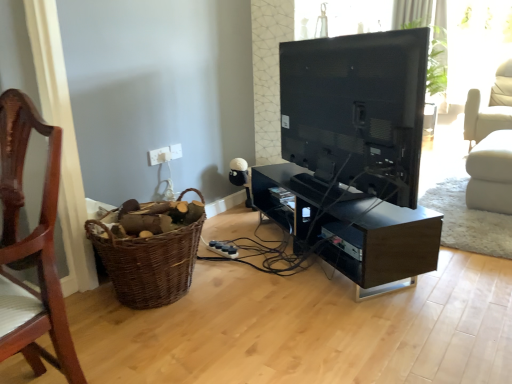
Image resolution: width=512 pixels, height=384 pixels. Describe the element at coordinates (159, 156) in the screenshot. I see `white plastic electric outlet at lower center, arranged as the second electric outlet when viewed from the right` at that location.

What do you see at coordinates (357, 109) in the screenshot?
I see `matte black tv at center` at bounding box center [357, 109].

Based on the photo, measure the distance between white plastic electric outlet at upper center, arranged as the 2th electric outlet when viewed from the left, and camera.

8.39 feet.

Find the location of a particular element. The height and width of the screenshot is (384, 512). white fabric swivel chair at right is located at coordinates (490, 173).

This screenshot has height=384, width=512. What are the coordinates of `brown woven basket at lower left` in the screenshot? It's located at (149, 264).

From the picture: Is white plastic electric outlet at lower center, the first electric outlet in the left-to-right sequence, wider than black glossy tv stand at center?

No.

Is white plastic electric outlet at lower center, arranged as the second electric outlet when viewed from the right, to the left or to the right of black glossy tv stand at center in the image?

white plastic electric outlet at lower center, arranged as the second electric outlet when viewed from the right, is positioned on black glossy tv stand at center's left side.

From the image's perspective, relative to black glossy tv stand at center, is white plastic electric outlet at lower center, the first electric outlet in the left-to-right sequence, above or below?

white plastic electric outlet at lower center, the first electric outlet in the left-to-right sequence, is above black glossy tv stand at center.

Which is in front, white plastic electric outlet at lower center, arranged as the second electric outlet when viewed from the right, or black glossy tv stand at center?

black glossy tv stand at center is closer to the camera.

Is white plastic electric outlet at lower center, arranged as the second electric outlet when viewed from the right, looking in the opposite direction of matte black tv at center?

No, white plastic electric outlet at lower center, arranged as the second electric outlet when viewed from the right, is not facing the opposite direction of matte black tv at center.

Does point (169, 155) come in front of point (307, 97)?

No, (169, 155) is further to viewer.

Is white plastic electric outlet at lower center, arranged as the second electric outlet when viewed from the right, positioned behind matte black tv at center?

Yes.

Who is bigger, white plastic electric outlet at lower center, arranged as the second electric outlet when viewed from the right, or matte black tv at center?

matte black tv at center.

Locate an element on the screen. television on the left of white fabric swivel chair at right is located at coordinates (357, 109).

Considering the sizes of objects white fabric swivel chair at right and matte black tv at center in the image provided, who is bigger, white fabric swivel chair at right or matte black tv at center?

matte black tv at center is bigger.

Can you confirm if white fabric swivel chair at right is taller than matte black tv at center?

No.

Is the position of white fabric swivel chair at right more distant than that of matte black tv at center?

Yes, the depth of white fabric swivel chair at right is greater than that of matte black tv at center.

Is white plastic electric outlet at lower center, arranged as the second electric outlet when viewed from the right, surrounded by white plastic electric outlet at upper center, marked as the first electric outlet in a right-to-left arrangement?

No, white plastic electric outlet at upper center, marked as the first electric outlet in a right-to-left arrangement, does not contain white plastic electric outlet at lower center, arranged as the second electric outlet when viewed from the right.

Is white plastic electric outlet at upper center, arranged as the 2th electric outlet when viewed from the left, facing away from white plastic electric outlet at lower center, arranged as the second electric outlet when viewed from the right?

No, white plastic electric outlet at lower center, arranged as the second electric outlet when viewed from the right, is not at the back of white plastic electric outlet at upper center, arranged as the 2th electric outlet when viewed from the left.

In the scene shown: From the image's perspective, who appears lower, white plastic electric outlet at upper center, arranged as the 2th electric outlet when viewed from the left, or white plastic electric outlet at lower center, the first electric outlet in the left-to-right sequence?

white plastic electric outlet at lower center, the first electric outlet in the left-to-right sequence.

Which of these two, white plastic electric outlet at upper center, marked as the first electric outlet in a right-to-left arrangement, or white plastic electric outlet at lower center, arranged as the second electric outlet when viewed from the right, stands taller?

Standing taller between the two is white plastic electric outlet at lower center, arranged as the second electric outlet when viewed from the right.

From the image's perspective, relative to white plastic electric outlet at upper center, arranged as the 2th electric outlet when viewed from the left, is wooden chair at left above or below?

wooden chair at left is situated lower than white plastic electric outlet at upper center, arranged as the 2th electric outlet when viewed from the left, in the image.

From a real-world perspective, relative to white plastic electric outlet at upper center, arranged as the 2th electric outlet when viewed from the left, is wooden chair at left vertically above or below?

From a real-world perspective, wooden chair at left is physically below white plastic electric outlet at upper center, arranged as the 2th electric outlet when viewed from the left.

Measure the distance from wooden chair at left to white plastic electric outlet at upper center, marked as the first electric outlet in a right-to-left arrangement.

wooden chair at left and white plastic electric outlet at upper center, marked as the first electric outlet in a right-to-left arrangement, are 4.94 feet apart.

Considering the relative sizes of wooden chair at left and white plastic electric outlet at upper center, marked as the first electric outlet in a right-to-left arrangement, in the image provided, is wooden chair at left taller than white plastic electric outlet at upper center, marked as the first electric outlet in a right-to-left arrangement,?

Correct, wooden chair at left is much taller as white plastic electric outlet at upper center, marked as the first electric outlet in a right-to-left arrangement.

Is wooden chair at left beside brown woven basket at lower left?

No, wooden chair at left is not touching brown woven basket at lower left.

Is wooden chair at left spatially inside brown woven basket at lower left, or outside of it?

wooden chair at left is located beyond the bounds of brown woven basket at lower left.

This screenshot has width=512, height=384. Find the location of `basket lying behind the wooden chair at left`. basket lying behind the wooden chair at left is located at coordinates (149, 264).

Is brown woven basket at lower left next to black glossy tv stand at center and touching it?

They are not placed beside each other.

Is brown woven basket at lower left further to the viewer compared to black glossy tv stand at center?

No, brown woven basket at lower left is in front of black glossy tv stand at center.

In the scene shown: Is black glossy tv stand at center at the back of brown woven basket at lower left?

brown woven basket at lower left does not have its back to black glossy tv stand at center.

Identify the location of the 1st electric outlet behind the black glossy tv stand at center, starting your count from the anchor. (159, 156).

Where is `television that is above the white plastic electric outlet at lower center, the first electric outlet in the left-to-right sequence (from the image's perspective)`? The width and height of the screenshot is (512, 384). television that is above the white plastic electric outlet at lower center, the first electric outlet in the left-to-right sequence (from the image's perspective) is located at coordinates (357, 109).

Based on their spatial positions, is wooden chair at left or brown woven basket at lower left closer to white plastic electric outlet at lower center, arranged as the second electric outlet when viewed from the right?

brown woven basket at lower left is positioned closer to the anchor white plastic electric outlet at lower center, arranged as the second electric outlet when viewed from the right.

Based on their spatial positions, is white plastic electric outlet at lower center, arranged as the second electric outlet when viewed from the right, or black glossy tv stand at center further from matte black tv at center?

Among the two, white plastic electric outlet at lower center, arranged as the second electric outlet when viewed from the right, is located further to matte black tv at center.

When comparing their distances from brown woven basket at lower left, does black glossy tv stand at center or white fabric swivel chair at right seem further?

white fabric swivel chair at right.

From the image, which object appears to be nearer to white plastic electric outlet at lower center, the first electric outlet in the left-to-right sequence, brown woven basket at lower left or white fabric swivel chair at right?

brown woven basket at lower left is positioned closer to the anchor white plastic electric outlet at lower center, the first electric outlet in the left-to-right sequence.

Looking at the image, which one is located closer to black glossy tv stand at center, wooden chair at left or white plastic electric outlet at lower center, the first electric outlet in the left-to-right sequence?

white plastic electric outlet at lower center, the first electric outlet in the left-to-right sequence, lies closer to black glossy tv stand at center than the other object.

Based on their spatial positions, is black glossy tv stand at center or white fabric swivel chair at right further from matte black tv at center?

white fabric swivel chair at right.

Looking at the image, which one is located further to brown woven basket at lower left, white plastic electric outlet at upper center, arranged as the 2th electric outlet when viewed from the left, or white plastic electric outlet at lower center, the first electric outlet in the left-to-right sequence?

Among the two, white plastic electric outlet at upper center, arranged as the 2th electric outlet when viewed from the left, is located further to brown woven basket at lower left.

Which object lies nearer to the anchor point black glossy tv stand at center, wooden chair at left or brown woven basket at lower left?

The object closer to black glossy tv stand at center is brown woven basket at lower left.

Image resolution: width=512 pixels, height=384 pixels. In order to click on shelf between matte black tv at center and white plastic electric outlet at upper center, marked as the first electric outlet in a right-to-left arrangement, from front to back in this screenshot , I will do `click(353, 229)`.

Find the location of `shelf between wooden chair at left and white plastic electric outlet at upper center, marked as the first electric outlet in a right-to-left arrangement, along the z-axis`. shelf between wooden chair at left and white plastic electric outlet at upper center, marked as the first electric outlet in a right-to-left arrangement, along the z-axis is located at coordinates (353, 229).

Where is `basket positioned between wooden chair at left and white plastic electric outlet at upper center, marked as the first electric outlet in a right-to-left arrangement, from near to far`? The image size is (512, 384). basket positioned between wooden chair at left and white plastic electric outlet at upper center, marked as the first electric outlet in a right-to-left arrangement, from near to far is located at coordinates (149, 264).

Where is `shelf between white plastic electric outlet at lower center, arranged as the second electric outlet when viewed from the right, and white fabric swivel chair at right, in the horizontal direction`? shelf between white plastic electric outlet at lower center, arranged as the second electric outlet when viewed from the right, and white fabric swivel chair at right, in the horizontal direction is located at coordinates [353, 229].